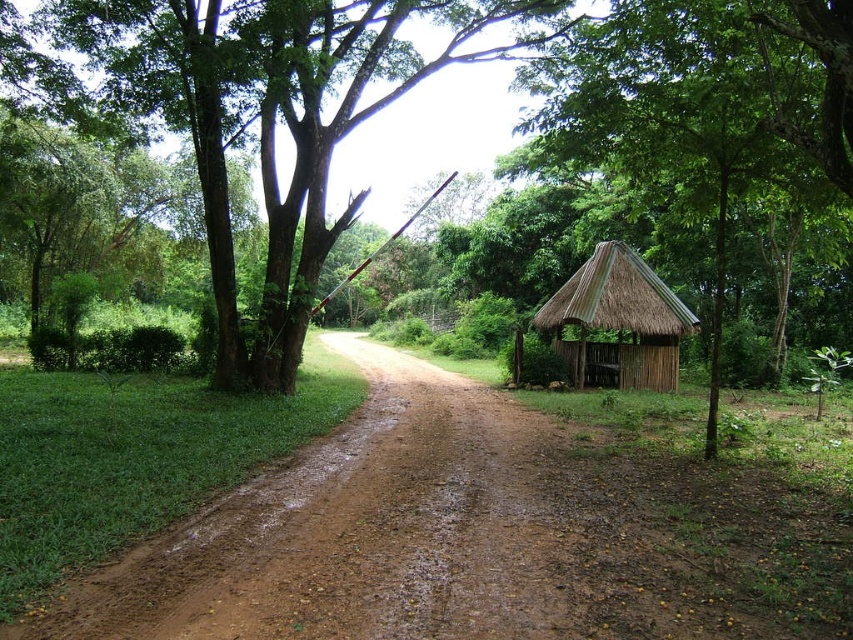
Question: Does brown dirt track at center come in front of green thatch hut at right?

Choices:
 (A) yes
 (B) no

Answer: (A)

Question: Which point is closer to the camera?

Choices:
 (A) green thatch hut at right
 (B) brown dirt track at center
 (C) green leafy tree at center

Answer: (B)

Question: Which of these objects is positioned farthest from the green leafy tree at center?

Choices:
 (A) thatched bamboo hut at right
 (B) brown dirt track at center

Answer: (A)

Question: Estimate the real-world distances between objects in this image. Which object is farther from the thatched bamboo hut at right?

Choices:
 (A) green thatch hut at right
 (B) green leafy tree at center
 (C) brown dirt track at center

Answer: (B)

Question: From the image, what is the correct spatial relationship of brown dirt track at center in relation to thatched bamboo hut at right?

Choices:
 (A) right
 (B) left

Answer: (B)

Question: Is green leafy tree at center behind thatched bamboo hut at right?

Choices:
 (A) no
 (B) yes

Answer: (A)